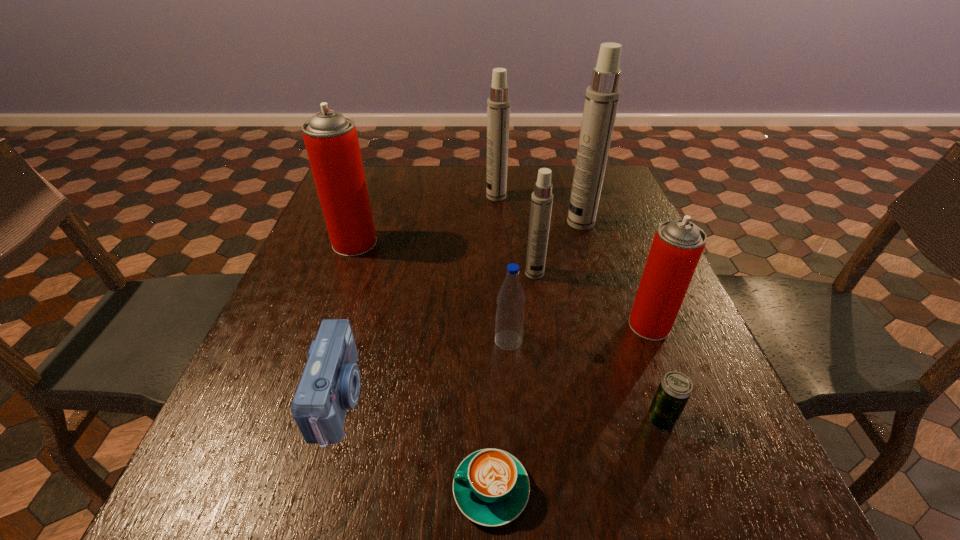
The width and height of the screenshot is (960, 540). What are the coordinates of `water bottle` in the screenshot? It's located at (509, 324).

Where is `the sixth tallest object`? the sixth tallest object is located at coordinates (509, 324).

Locate an element on the screen. This screenshot has width=960, height=540. camera is located at coordinates (330, 383).

I want to click on beer can, so (x=675, y=388).

Where is `cappuccino`? cappuccino is located at coordinates (491, 487).

I want to click on the nearest object, so click(491, 487).

You are a GUI agent. You are given a task and a screenshot of the screen. Output one action in this format:
    pyautogui.click(x=<x>, y=<y>)
    Task: Click on the free location located 0.390m on the left of the tallest aerosol can
    This screenshot has width=960, height=540.
    Given the screenshot: What is the action you would take?
    pyautogui.click(x=425, y=223)

Where is `vacant space located 0.290m on the right of the bigger red aerosol can`? The image size is (960, 540). vacant space located 0.290m on the right of the bigger red aerosol can is located at coordinates tap(489, 243).

Locate an element on the screen. blank area located 0.050m on the right of the leftmost white aerosol can is located at coordinates (523, 197).

You are a GUI agent. You are given a task and a screenshot of the screen. Output one action in this format:
    pyautogui.click(x=<x>, y=<y>)
    Task: Click on the free space located 0.070m on the back of the nearer red aerosol can
    The image size is (960, 540).
    Given the screenshot: What is the action you would take?
    pyautogui.click(x=636, y=289)